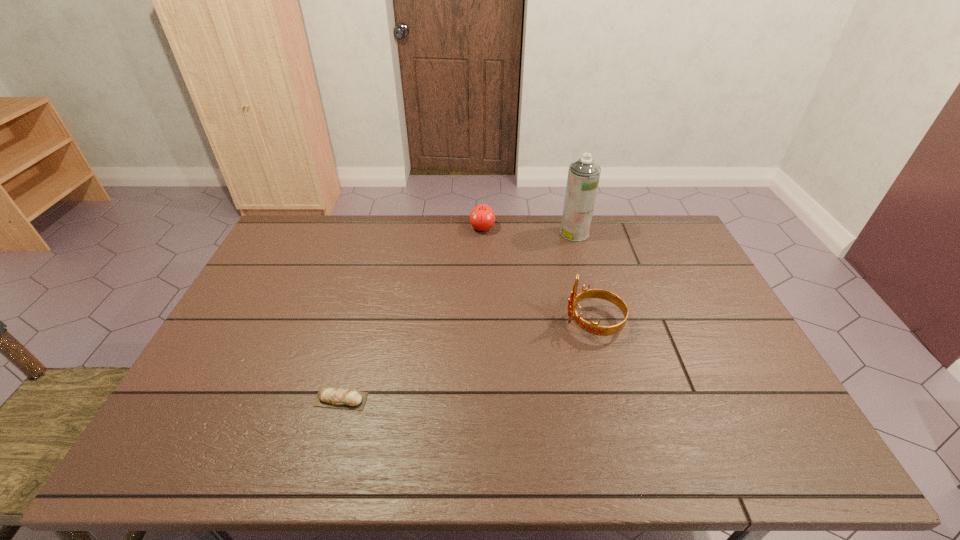
You are a GUI agent. You are given a task and a screenshot of the screen. Output one action in this format:
    pyautogui.click(x=<x>, y=<y>)
    Task: Click on the empty space that is in between the apple and the aerosol can
    The height and width of the screenshot is (540, 960).
    Given the screenshot: What is the action you would take?
    pyautogui.click(x=528, y=231)

What are the coordinates of `object that is the third closest one to the aerosol can` in the screenshot? It's located at (327, 397).

Locate an element on the screen. Image resolution: width=960 pixels, height=540 pixels. the third closest object to the second nearest object is located at coordinates (327, 397).

Locate an element on the screen. vacant space that satisfies the following two spatial constraints: 1. on the front-facing side of the tiara; 2. on the front side of the shortest object is located at coordinates (613, 400).

The image size is (960, 540). I want to click on blank area in the image that satisfies the following two spatial constraints: 1. on the front side of the tallest object; 2. on the front-facing side of the second tallest object, so click(599, 322).

Find the location of `vacant area in the image that satisfies the following two spatial constraints: 1. on the front side of the aerosol can; 2. on the front-facing side of the third farthest object`. vacant area in the image that satisfies the following two spatial constraints: 1. on the front side of the aerosol can; 2. on the front-facing side of the third farthest object is located at coordinates (599, 322).